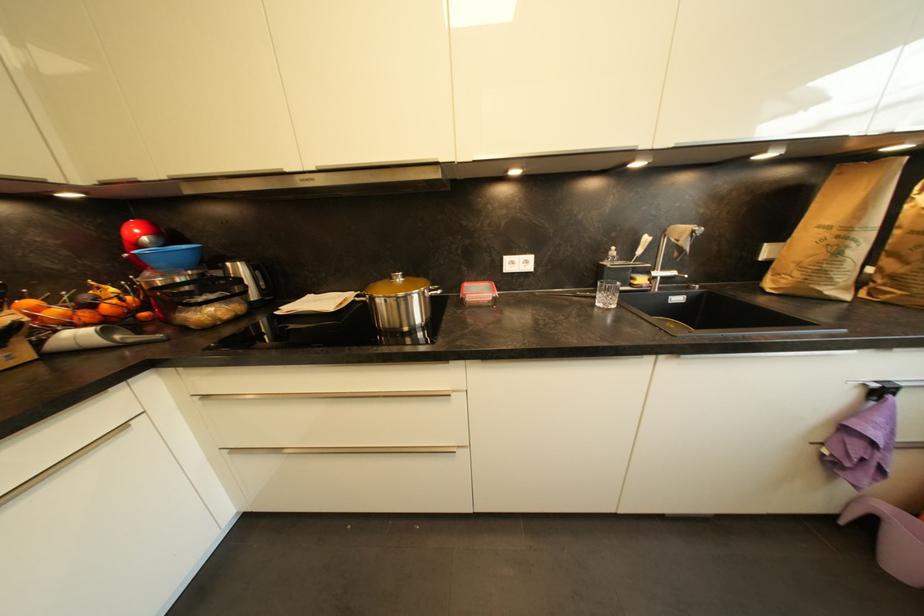
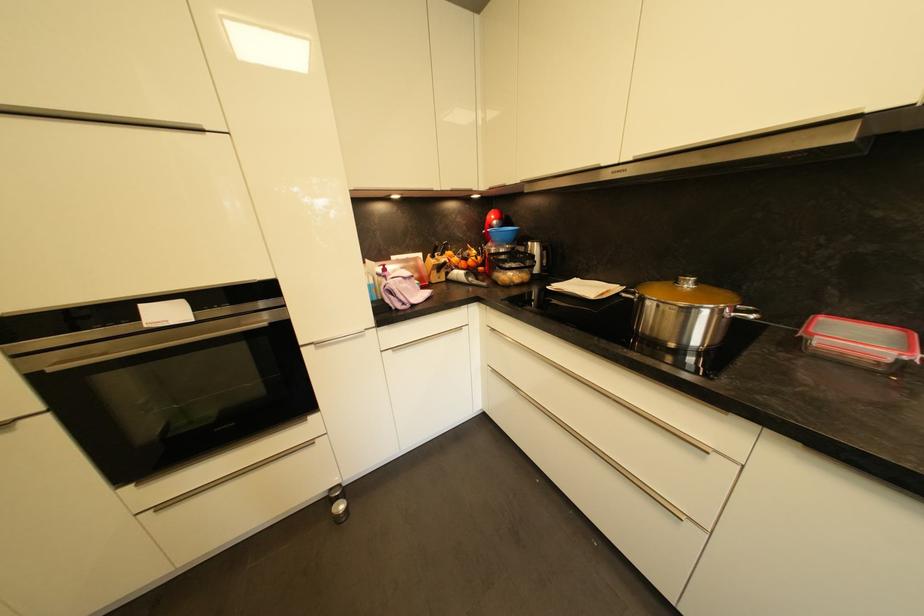
The point at (420, 334) is marked in the first image. Where is the corresponding point in the second image?

(690, 357)